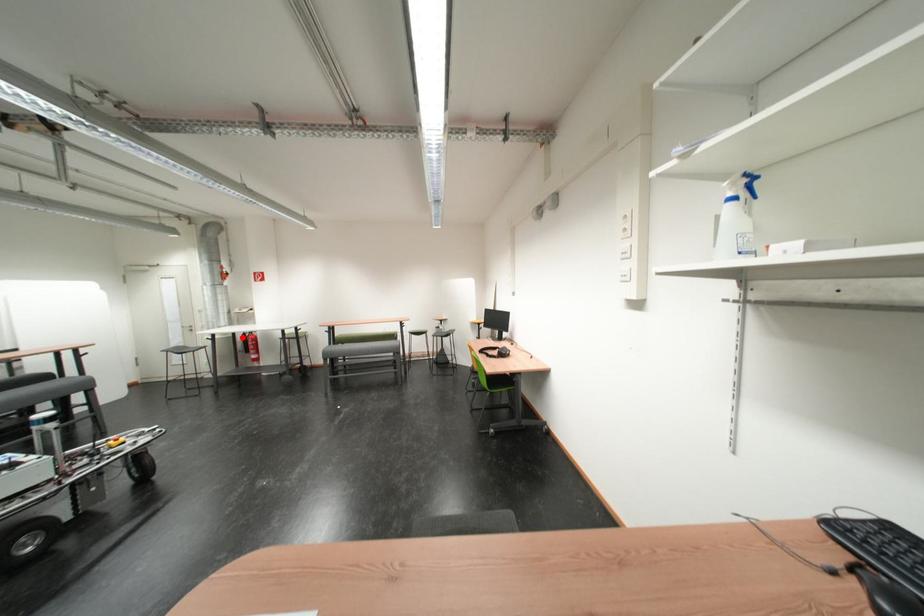
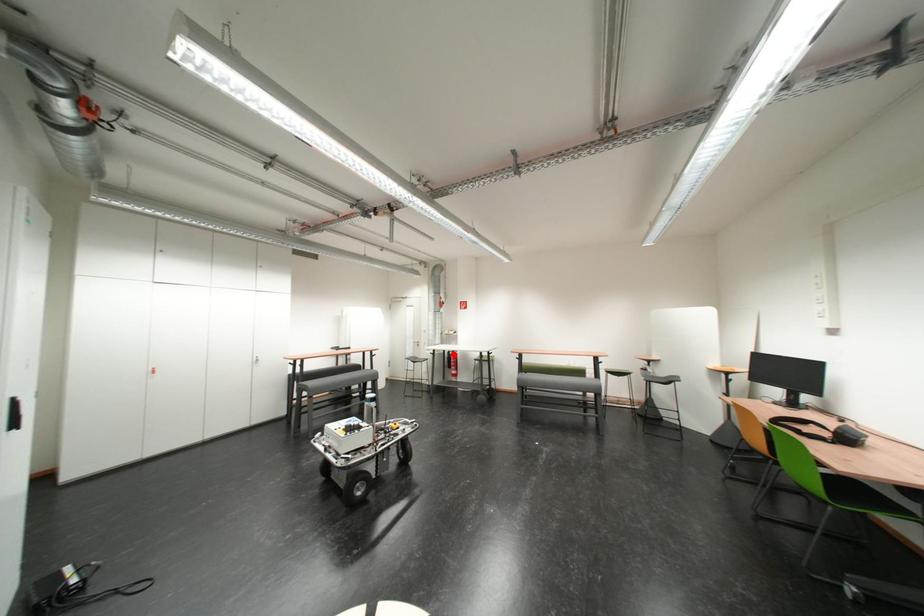
I am providing you with two images of the same scene from different viewpoints. A red point is marked on the first image and another point is marked on the second image. Is the marked point in image1 the same physical position as the marked point in image2?

Yes